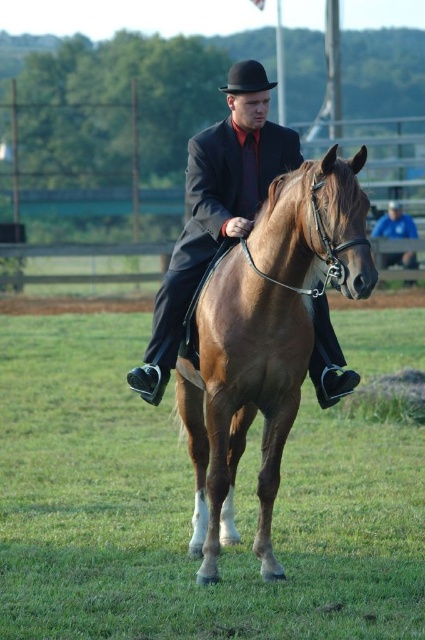
Question: Among these objects, which one is nearest to the camera?

Choices:
 (A) brown smooth horse at center
 (B) blue fabric at lower right
 (C) matte black suit at center
 (D) black felt fedora at center

Answer: (A)

Question: Can you confirm if brown glossy horse at center is wider than blue fabric at lower right?

Choices:
 (A) no
 (B) yes

Answer: (B)

Question: Which object appears farthest from the camera in this image?

Choices:
 (A) matte black suit at center
 (B) black felt fedora at center
 (C) blue fabric at lower right

Answer: (C)

Question: Can you confirm if brown smooth horse at center is wider than blue fabric at lower right?

Choices:
 (A) yes
 (B) no

Answer: (A)

Question: Does blue fabric at lower right lie in front of black felt fedora at center?

Choices:
 (A) no
 (B) yes

Answer: (A)

Question: Among these objects, which one is farthest from the camera?

Choices:
 (A) black felt fedora at center
 (B) brown smooth horse at center

Answer: (A)